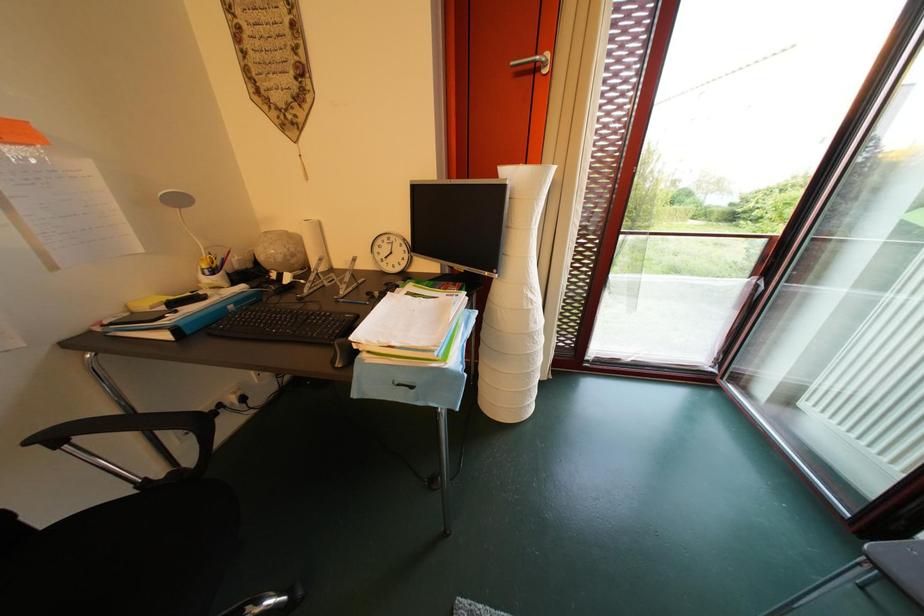
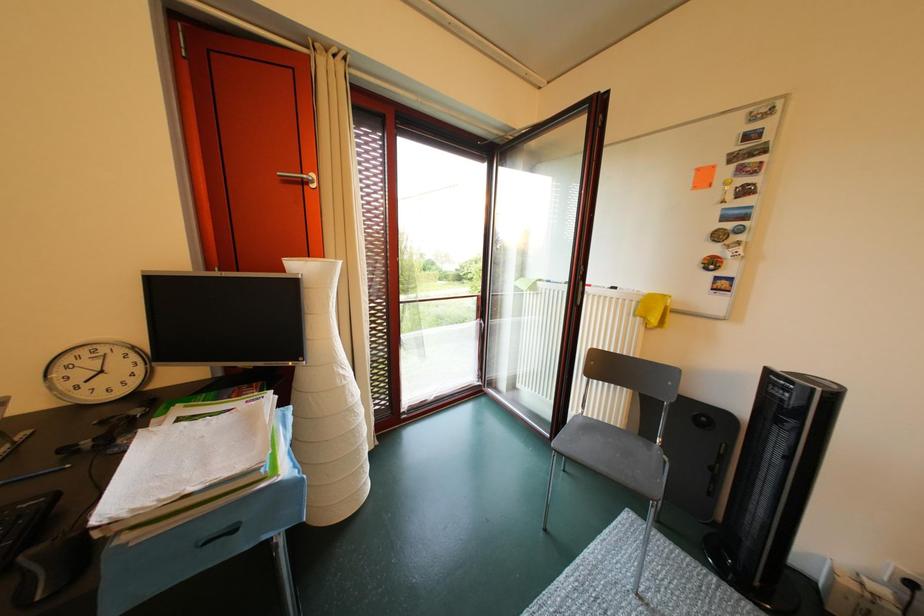
Question: The camera is either moving clockwise (left) or counter-clockwise (right) around the object. The first image is from the beginning of the video and the second image is from the end. Is the camera moving left or right when shooting the video?

Choices:
 (A) Left
 (B) Right

Answer: (A)